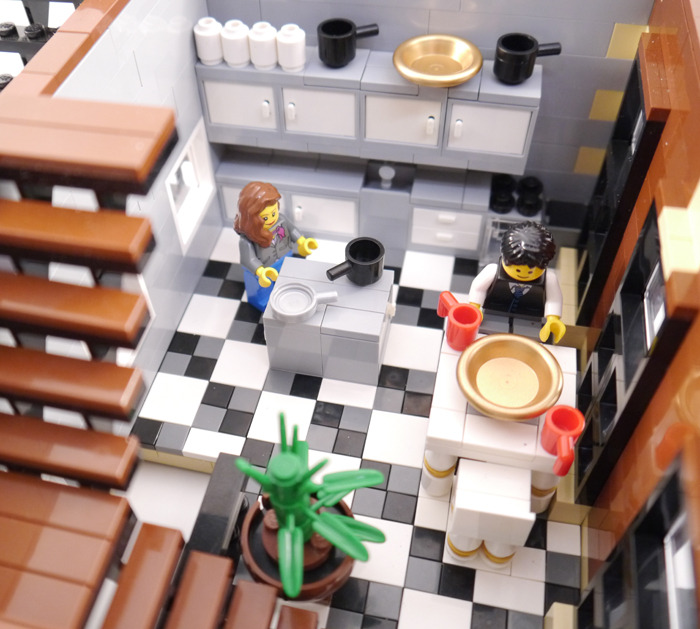
At what (x,y) coordinates should I click in order to perform the action: click on white handle on white cabinet door. Please return your answer as a coordinate pair (x, y). The height and width of the screenshot is (629, 700). Looking at the image, I should click on [455, 129].